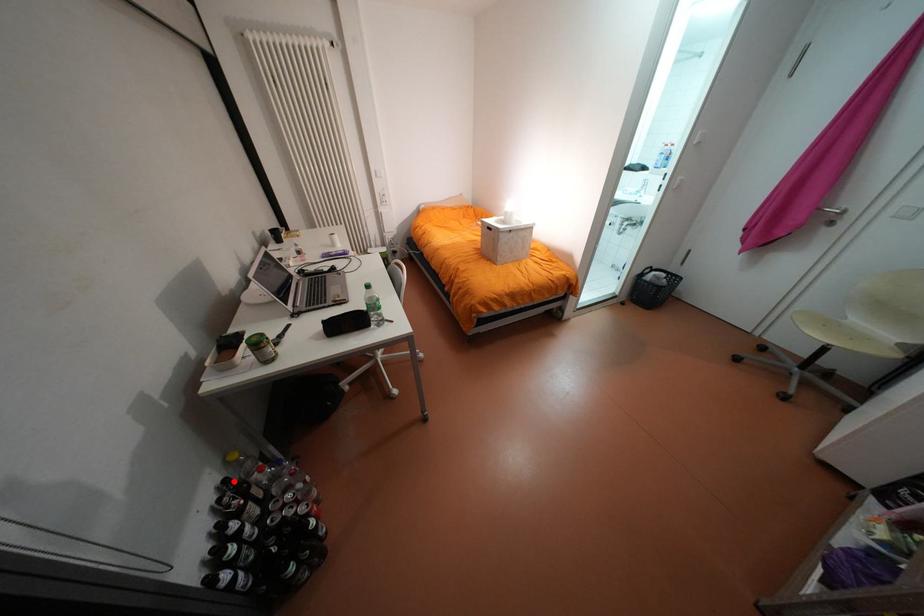
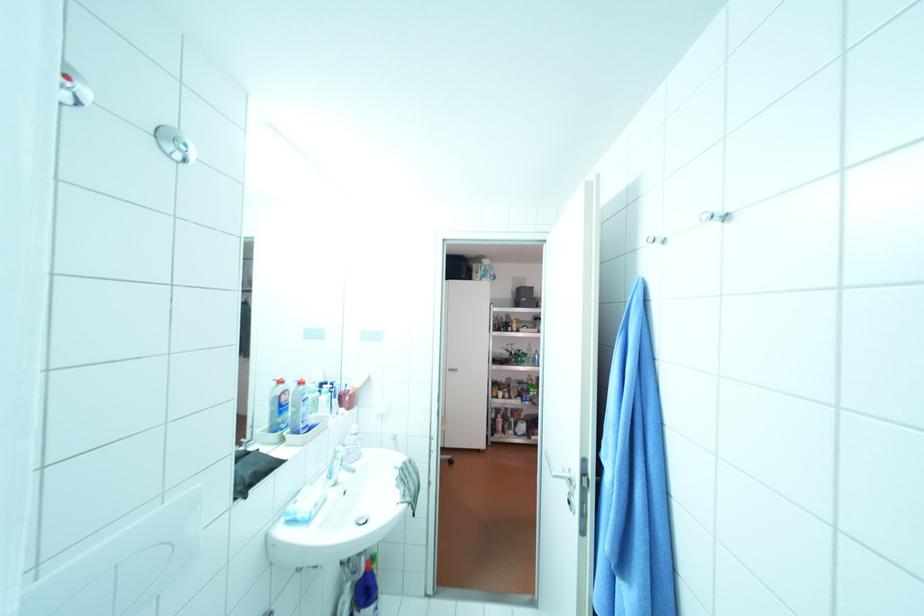
Question: I am providing you with two images of the same scene from different viewpoints. A red point is marked on the first image. Is the red point's position out of view in image 2?

Choices:
 (A) Yes
 (B) No

Answer: (A)